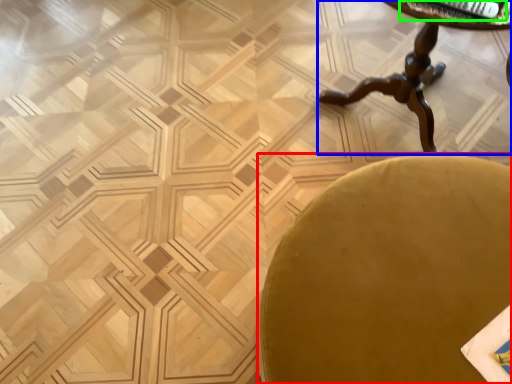
Question: Based on their relative distances, which object is farther from chair (highlighted by a red box)? Choose from table (highlighted by a blue box) and magazine (highlighted by a green box).

Choices:
 (A) table
 (B) magazine

Answer: (A)